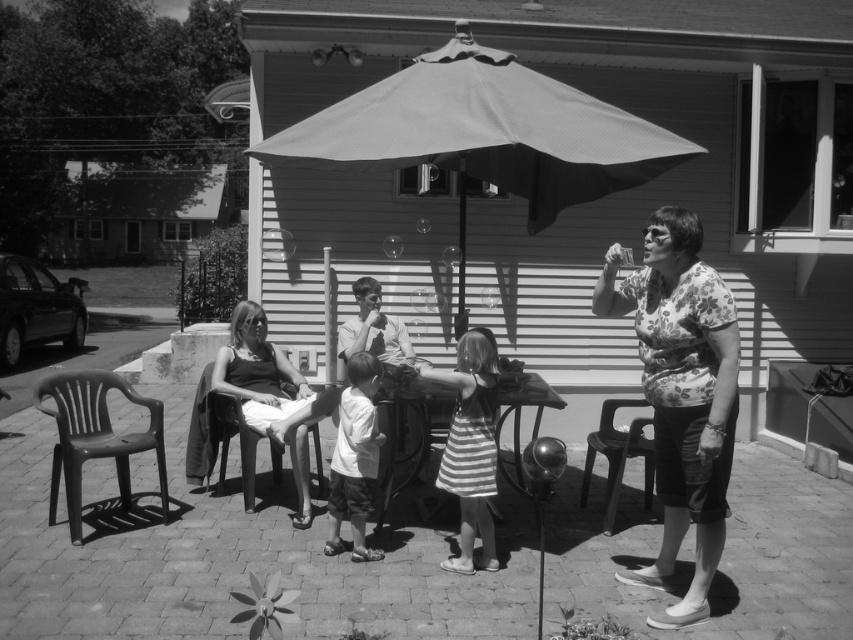
Can you confirm if floral shirt at center is positioned to the left of striped fabric dress at center?

Incorrect, floral shirt at center is not on the left side of striped fabric dress at center.

Which is below, floral shirt at center or striped fabric dress at center?

striped fabric dress at center is lower down.

This screenshot has width=853, height=640. In order to click on floral shirt at center in this screenshot , I will do point(682,392).

Locate an element on the screen. The width and height of the screenshot is (853, 640). floral shirt at center is located at coordinates (682, 392).

Can you confirm if black plastic chair at lower left is thinner than metallic silver table at center?

Incorrect, black plastic chair at lower left's width is not less than metallic silver table at center's.

Does point (154, 413) come closer to viewer compared to point (421, 442)?

Yes, point (154, 413) is closer to viewer.

You are a GUI agent. You are given a task and a screenshot of the screen. Output one action in this format:
    pyautogui.click(x=<x>, y=<y>)
    Task: Click on the black plastic chair at lower left
    
    Given the screenshot: What is the action you would take?
    pyautogui.click(x=96, y=436)

Does textured fabric umbrella at center have a smaller size compared to black plastic chair at lower left?

Incorrect, textured fabric umbrella at center is not smaller in size than black plastic chair at lower left.

Who is taller, textured fabric umbrella at center or black plastic chair at lower left?

With more height is textured fabric umbrella at center.

The image size is (853, 640). What do you see at coordinates (485, 132) in the screenshot? I see `textured fabric umbrella at center` at bounding box center [485, 132].

Find the location of a particular element. The image size is (853, 640). textured fabric umbrella at center is located at coordinates (485, 132).